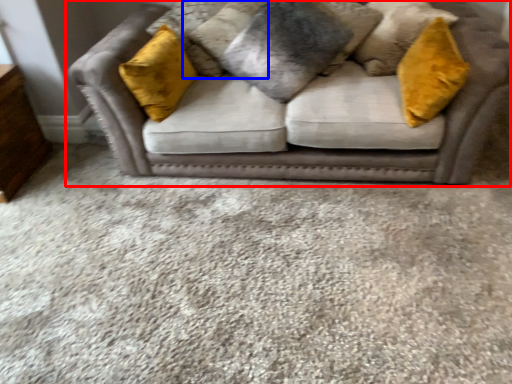
Question: Which point is closer to the camera, studio couch (highlighted by a red box) or pillow (highlighted by a blue box)?

Choices:
 (A) studio couch
 (B) pillow

Answer: (A)